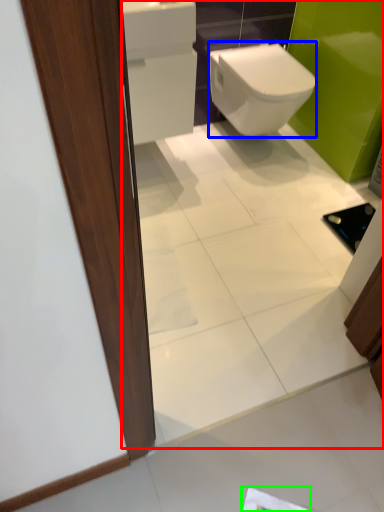
Question: Which object is the closest to the mirror (highlighted by a red box)? Choose among these: bidet (highlighted by a blue box) or paper (highlighted by a green box).

Choices:
 (A) bidet
 (B) paper

Answer: (A)